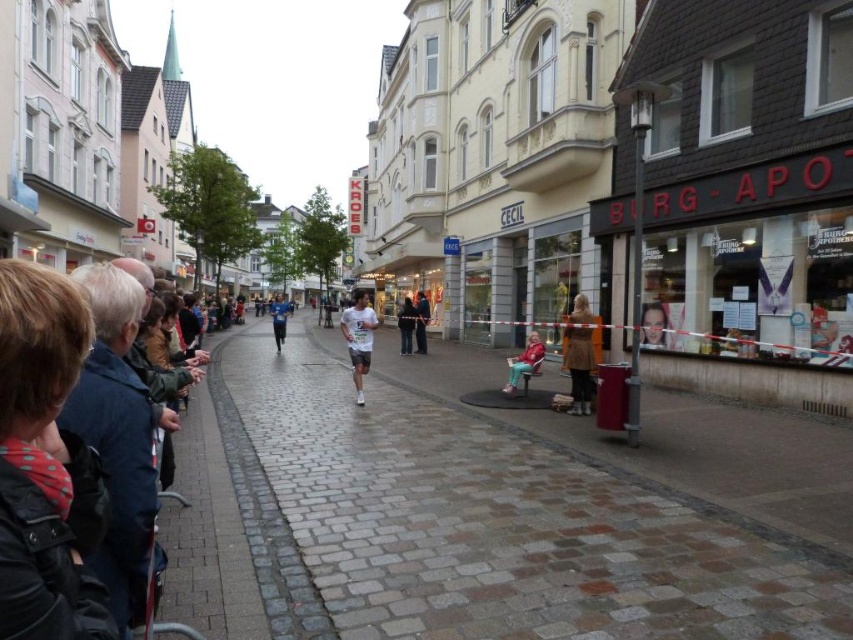
Question: Estimate the real-world distances between objects in this image. Which object is closer to the dark blue jacket at left?

Choices:
 (A) brown cobblestone pavement at center
 (B) matte pink coat at center

Answer: (A)

Question: Based on their relative distances, which object is nearer to the matte pink coat at center?

Choices:
 (A) dark gray pants at center
 (B) brown cobblestone pavement at center
 (C) matte black jacket at center
 (D) dark blue jacket at left

Answer: (B)

Question: Is dark blue jacket at left thinner than smooth skin face at center?

Choices:
 (A) yes
 (B) no

Answer: (B)

Question: Can you confirm if matte brown storefront at right is positioned to the right of dark blue jacket at left?

Choices:
 (A) no
 (B) yes

Answer: (B)

Question: Is blue fabric shirt at center positioned in front of matte black jacket at center?

Choices:
 (A) no
 (B) yes

Answer: (A)

Question: Which object is positioned closest to the matte pink coat at center?

Choices:
 (A) white matte running shirt at center
 (B) brown leather coat at center
 (C) dark blue jacket at left

Answer: (B)